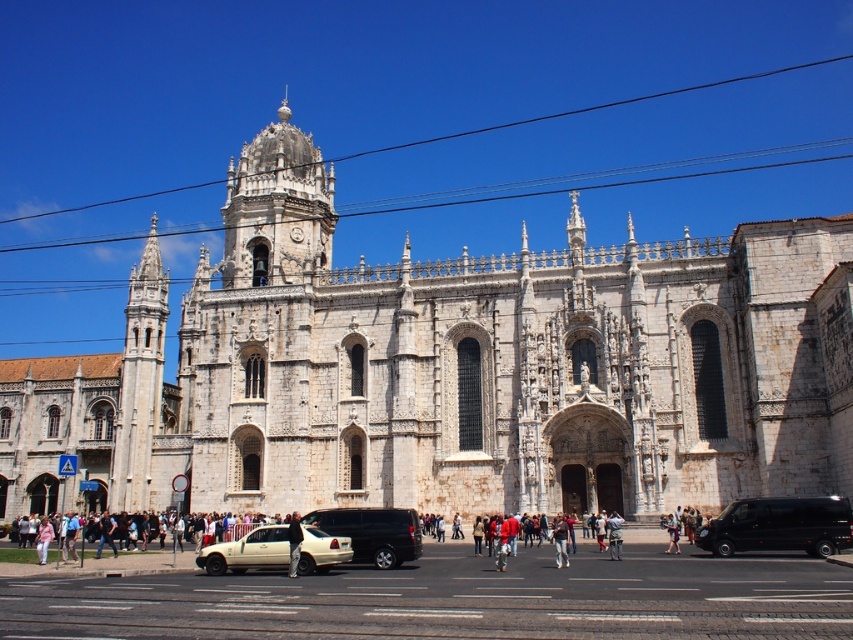
Consider the image. Between black matte van at center and light beige fabric jacket at lower center, which one is positioned lower?

Positioned lower is light beige fabric jacket at lower center.

Is point (808, 525) in front of point (1, 550)?

Yes, point (808, 525) is closer to viewer.

The image size is (853, 640). Find the location of `black matte van at center`. black matte van at center is located at coordinates (779, 525).

Can you confirm if white stone tower at upper center is bigger than light blue jeans at lower center?

Yes.

Does white stone tower at upper center have a lesser height compared to light blue jeans at lower center?

No, white stone tower at upper center is not shorter than light blue jeans at lower center.

This screenshot has width=853, height=640. Find the location of `white stone tower at upper center`. white stone tower at upper center is located at coordinates (276, 208).

Identify the location of black matte van at center. (779, 525).

Which of these two, black matte van at center or metallic silver van at center, stands taller?

Standing taller between the two is metallic silver van at center.

This screenshot has height=640, width=853. I want to click on black matte van at center, so click(779, 525).